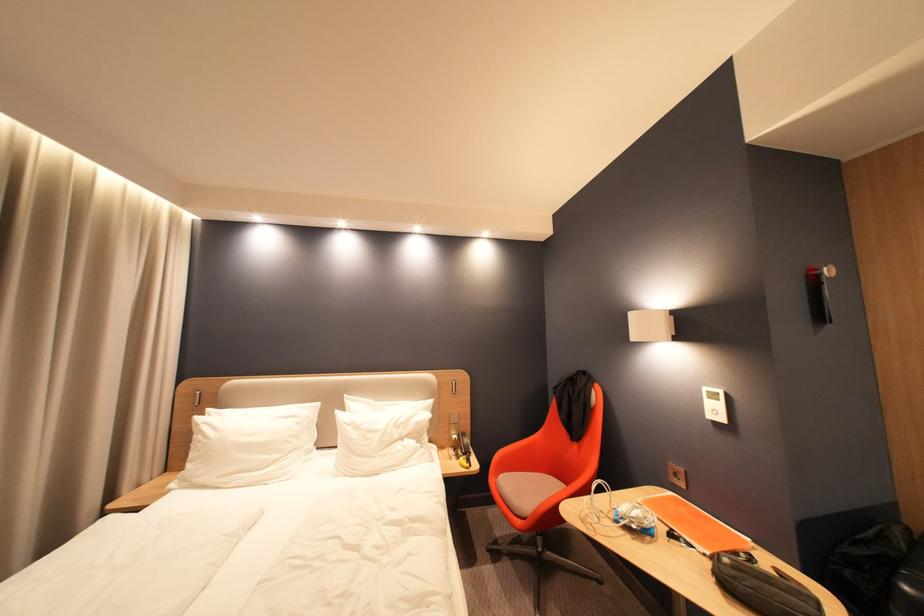
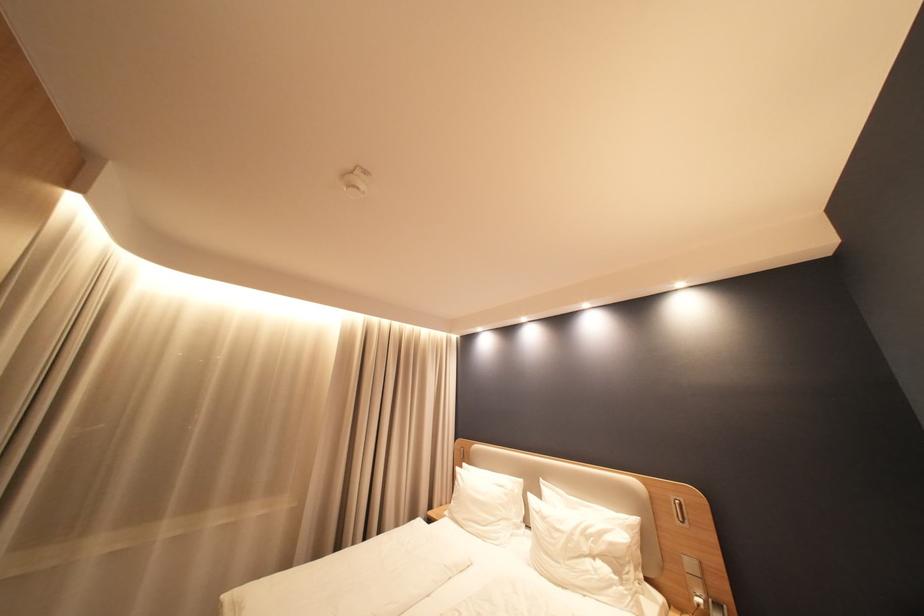
Locate, in the second image, the point that corresponds to (x=213, y=424) in the first image.

(468, 475)